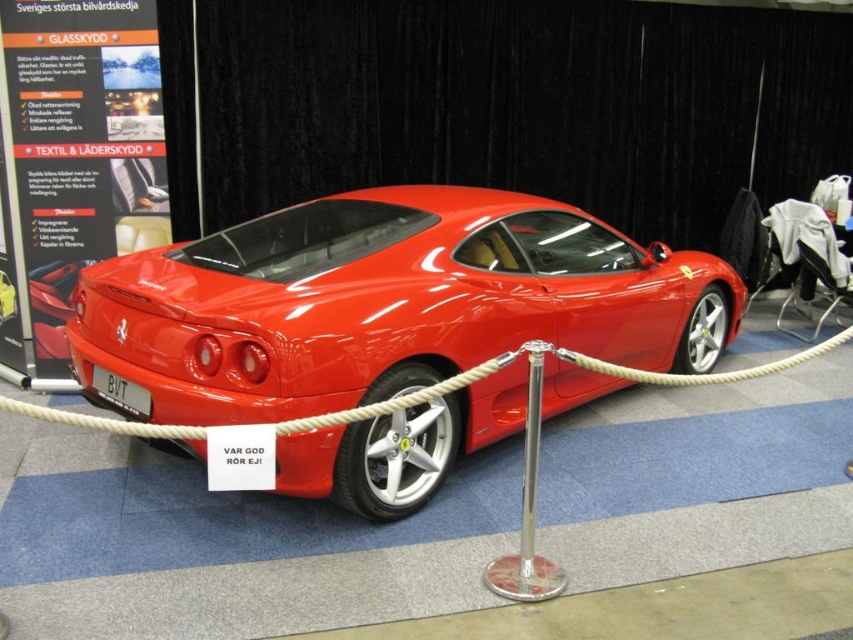
You are a visitor at the exhibition and want to take a photo of the shiny red ferrari at center without getting too close. You notice the white rope at center nearby. Which object is closer to you, allowing you to take the photo from a safe distance?

The shiny red ferrari at center is closer to you than the white rope at center, so you can take the photo from a safe distance without getting too close to either.

You are a photographer setting up a shoot for a car magazine. You need to position a camera on a tripod to capture the glossy red car at center without the polished silver pole at center blocking the view. Given their heights, can the camera be placed low enough to avoid the pole while still framing the car properly?

The polished silver pole at center is taller than the glossy red car at center. By placing the camera low on the tripod, the photographer can angle the shot upward to focus on the car while keeping the pole out of the frame or minimizing its obstruction.